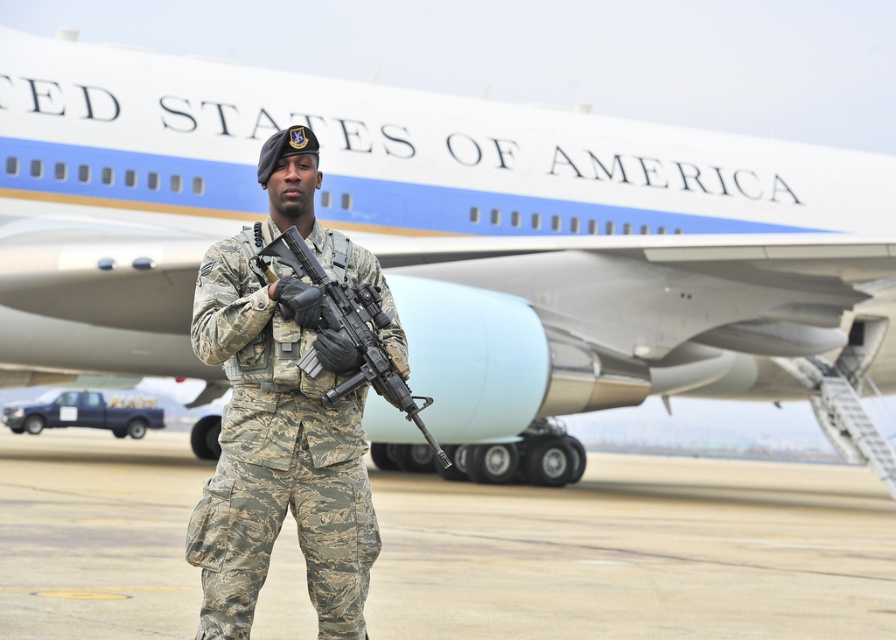
Can you confirm if camouflage pants at center is smaller than camouflage uniform at center?

Actually, camouflage pants at center might be larger than camouflage uniform at center.

Who is lower down, camouflage pants at center or camouflage uniform at center?

Positioned lower is camouflage pants at center.

You are a GUI agent. You are given a task and a screenshot of the screen. Output one action in this format:
    pyautogui.click(x=<x>, y=<y>)
    Task: Click on the camouflage pants at center
    The width and height of the screenshot is (896, 640).
    Given the screenshot: What is the action you would take?
    pyautogui.click(x=636, y=554)

Can you confirm if white matte airplane at center is positioned to the left of camouflage-patterned rifle at center?

No, white matte airplane at center is not to the left of camouflage-patterned rifle at center.

Does white matte airplane at center appear under camouflage-patterned rifle at center?

No.

The image size is (896, 640). I want to click on white matte airplane at center, so coord(449,243).

Locate an element on the screen. This screenshot has width=896, height=640. white matte airplane at center is located at coordinates pyautogui.click(x=449, y=243).

Which is behind, point (351, 216) or point (498, 540)?

The point (351, 216) is behind.

Does white matte airplane at center appear on the left side of camouflage pants at center?

In fact, white matte airplane at center is to the right of camouflage pants at center.

Who is more forward, (780, 316) or (600, 618)?

Point (600, 618) is in front.

Find the location of a particular element. This screenshot has height=640, width=896. white matte airplane at center is located at coordinates (449, 243).